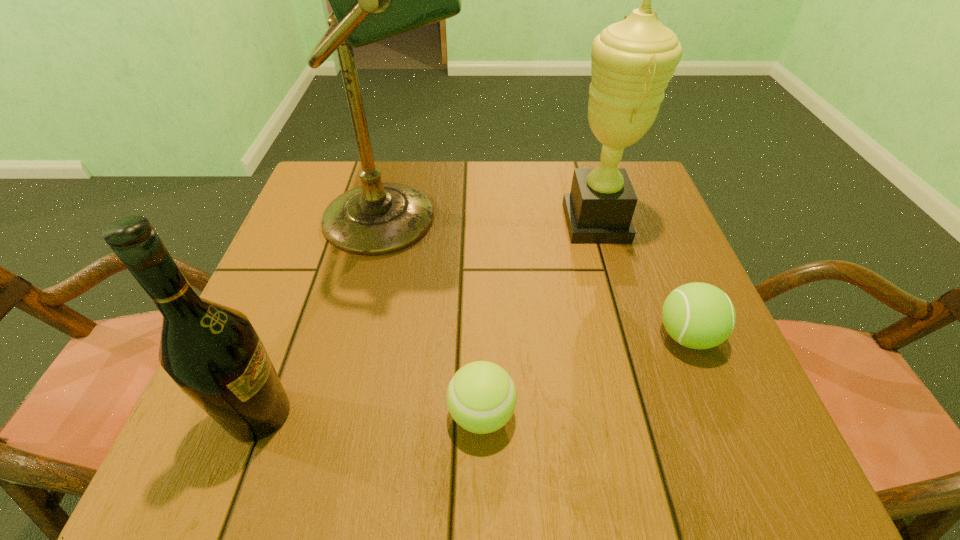
Where is `tennis ball positioned at the right edge`? Image resolution: width=960 pixels, height=540 pixels. tennis ball positioned at the right edge is located at coordinates (697, 315).

Find the location of `object at the far left corner`. object at the far left corner is located at coordinates (372, 0).

Find the location of `object present at the near left corner`. object present at the near left corner is located at coordinates coord(212,352).

Image resolution: width=960 pixels, height=540 pixels. I want to click on object at the far right corner, so click(633, 60).

The image size is (960, 540). In the image, there is a desktop. Identify the location of vacant space at the far edge. (563, 166).

What are the coordinates of `vacant area at the near edge` in the screenshot? It's located at (414, 470).

I want to click on vacant position at the left edge of the desktop, so pos(316,292).

At what (x,y) coordinates should I click in order to perform the action: click on blank space at the right edge of the desktop. Please return your answer as a coordinate pair (x, y). Looking at the image, I should click on (651, 318).

In order to click on free location at the far left corner in this screenshot , I will do `click(313, 185)`.

Locate an element on the screen. free point at the near left corner is located at coordinates (294, 454).